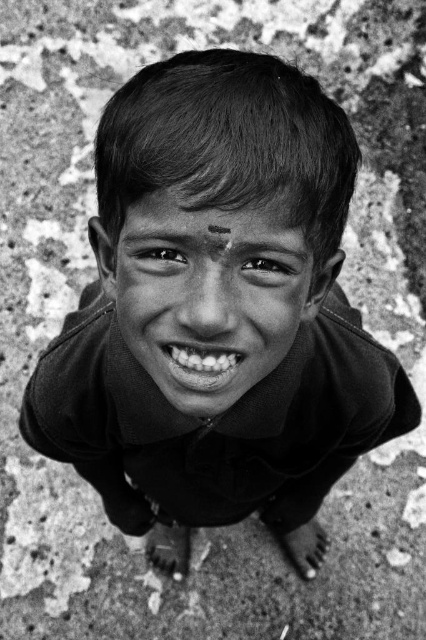
You are a photographer adjusting the lighting for a portrait. You notice the black matte face at center and the white glossy teeth at center in your frame. Which object should you adjust the lighting to make more visible?

The black matte face at center is in front of the white glossy teeth at center, so adjusting the lighting on the black matte face at center would help make the white glossy teeth at center more visible by creating contrast.

You are an artist trying to sketch this scene. You need to ensure the proportions are accurate. Which object, the black matte face at center or the white glossy teeth at center, should be drawn taller?

The black matte face at center is taller than the white glossy teeth at center, so you should draw the black matte face at center taller than the white glossy teeth at center.